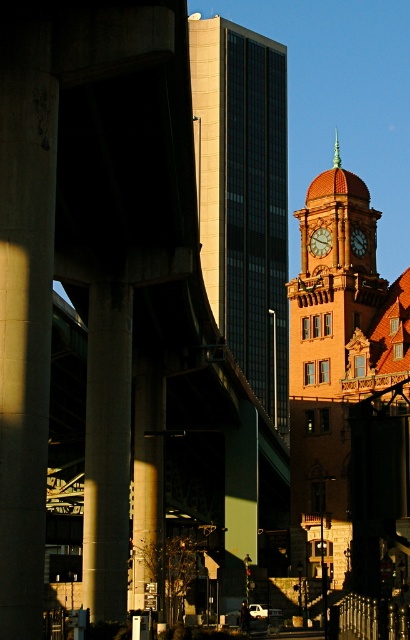
Question: Considering the real-world distances, which object is closest to the concrete pillar at left?

Choices:
 (A) matte gold clock at center
 (B) smooth concrete pillar at center

Answer: (B)

Question: Which object is closer to the camera taking this photo?

Choices:
 (A) smooth concrete pillar at center
 (B) gold textured clock at center
 (C) metallic pole at center

Answer: (A)

Question: Is concrete pillar at center smaller than metallic pole at center?

Choices:
 (A) yes
 (B) no

Answer: (B)

Question: Which is nearer to the brown stone clock tower at center?

Choices:
 (A) matte orange clock tower at center right
 (B) smooth concrete pillar at center
 (C) gold textured clock at center
 (D) metallic pole at center

Answer: (D)

Question: Is smooth concrete pillar at center smaller than matte gold clock at center?

Choices:
 (A) yes
 (B) no

Answer: (B)

Question: In this image, where is concrete pillar at left located relative to gold textured clock at center?

Choices:
 (A) right
 (B) left

Answer: (B)